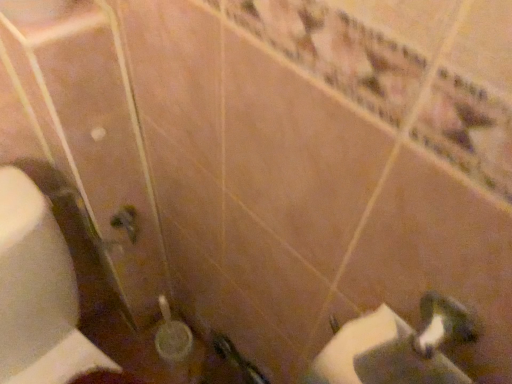
What is the approximate width of white glossy sink at lower right?

The width of white glossy sink at lower right is 5.09 inches.

The image size is (512, 384). Find the location of `white glossy sink at lower right`. white glossy sink at lower right is located at coordinates (395, 347).

This screenshot has height=384, width=512. What do you see at coordinates (395, 347) in the screenshot?
I see `white glossy sink at lower right` at bounding box center [395, 347].

Locate an element on the screen. This screenshot has width=512, height=384. white matte toilet paper at lower left is located at coordinates (38, 291).

The height and width of the screenshot is (384, 512). What do you see at coordinates (38, 291) in the screenshot?
I see `white matte toilet paper at lower left` at bounding box center [38, 291].

In order to face white matte toilet paper at lower left, should I rotate leftwards or rightwards?

Turn left by 23.792 degrees to look at white matte toilet paper at lower left.

The image size is (512, 384). What are the coordinates of `white glossy sink at lower right` in the screenshot? It's located at (395, 347).

Considering the relative positions of white glossy sink at lower right and white matte toilet paper at lower left in the image provided, is white glossy sink at lower right to the left or to the right of white matte toilet paper at lower left?

In the image, white glossy sink at lower right appears on the right side of white matte toilet paper at lower left.

Is white glossy sink at lower right positioned behind white matte toilet paper at lower left?

That is False.

Considering the points (373, 364) and (25, 345), which point is in front, point (373, 364) or point (25, 345)?

The point (373, 364) is in front.

From the image's perspective, is white glossy sink at lower right below white matte toilet paper at lower left?

Actually, white glossy sink at lower right appears above white matte toilet paper at lower left in the image.

From a real-world perspective, who is located higher, white glossy sink at lower right or white matte toilet paper at lower left?

white glossy sink at lower right is physically above.

Between white glossy sink at lower right and white matte toilet paper at lower left, which one has larger width?

Wider between the two is white matte toilet paper at lower left.

Does white glossy sink at lower right have a greater height compared to white matte toilet paper at lower left?

No, white glossy sink at lower right is not taller than white matte toilet paper at lower left.

Is white glossy sink at lower right bigger than white matte toilet paper at lower left?

No, white glossy sink at lower right is not bigger than white matte toilet paper at lower left.

From the picture: Choose the correct answer: Is white glossy sink at lower right inside white matte toilet paper at lower left or outside it?

white glossy sink at lower right exists outside the volume of white matte toilet paper at lower left.

Is white glossy sink at lower right next to white matte toilet paper at lower left and touching it?

No, white glossy sink at lower right is not next to white matte toilet paper at lower left.

Is white glossy sink at lower right facing towards white matte toilet paper at lower left?

No, white glossy sink at lower right does not turn towards white matte toilet paper at lower left.

Can you tell me how much white glossy sink at lower right and white matte toilet paper at lower left differ in facing direction?

The angular difference between white glossy sink at lower right and white matte toilet paper at lower left is 90 degrees.

Locate an element on the screen. Image resolution: width=512 pixels, height=384 pixels. toilet paper on the left side of white glossy sink at lower right is located at coordinates (38, 291).

Is white matte toilet paper at lower left to the left of white glossy sink at lower right from the viewer's perspective?

Correct, you'll find white matte toilet paper at lower left to the left of white glossy sink at lower right.

Is white matte toilet paper at lower left in front of or behind white glossy sink at lower right in the image?

Visually, white matte toilet paper at lower left is located behind white glossy sink at lower right.

Is point (61, 381) less distant than point (390, 313)?

No, it is not.

From the image's perspective, is white matte toilet paper at lower left positioned above or below white glossy sink at lower right?

Based on their image positions, white matte toilet paper at lower left is located beneath white glossy sink at lower right.

In the scene shown: From a real-world perspective, is white matte toilet paper at lower left on white glossy sink at lower right?

No, from a real-world perspective, white matte toilet paper at lower left is not over white glossy sink at lower right

Which object is wider, white matte toilet paper at lower left or white glossy sink at lower right?

Wider between the two is white matte toilet paper at lower left.

In terms of height, does white matte toilet paper at lower left look taller or shorter compared to white glossy sink at lower right?

Clearly, white matte toilet paper at lower left is taller compared to white glossy sink at lower right.

Is white matte toilet paper at lower left bigger or smaller than white glossy sink at lower right?

In the image, white matte toilet paper at lower left appears to be larger than white glossy sink at lower right.

Is white glossy sink at lower right surrounded by white matte toilet paper at lower left?

That's incorrect, white glossy sink at lower right is not inside white matte toilet paper at lower left.

Is white matte toilet paper at lower left not near white glossy sink at lower right?

Actually, white matte toilet paper at lower left and white glossy sink at lower right are a little close together.

Could you tell me if white matte toilet paper at lower left is turned towards white glossy sink at lower right?

No, white matte toilet paper at lower left is not facing towards white glossy sink at lower right.

At what (x,y) coordinates should I click in order to perform the action: click on sink that appears in front of the white matte toilet paper at lower left. Please return your answer as a coordinate pair (x, y). This screenshot has height=384, width=512. Looking at the image, I should click on pos(395,347).

The height and width of the screenshot is (384, 512). Find the location of `toilet paper behind the white glossy sink at lower right`. toilet paper behind the white glossy sink at lower right is located at coordinates (38, 291).

Identify the location of sink located on the right of white matte toilet paper at lower left. The image size is (512, 384). (395, 347).